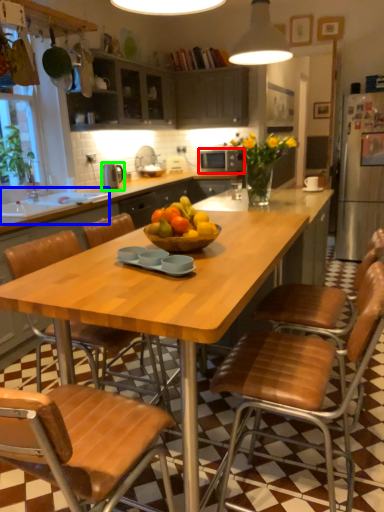
Question: Which is nearer to the kitchen appliance (highlighted by a red box)? sink (highlighted by a blue box) or appliance (highlighted by a green box).

Choices:
 (A) sink
 (B) appliance

Answer: (B)